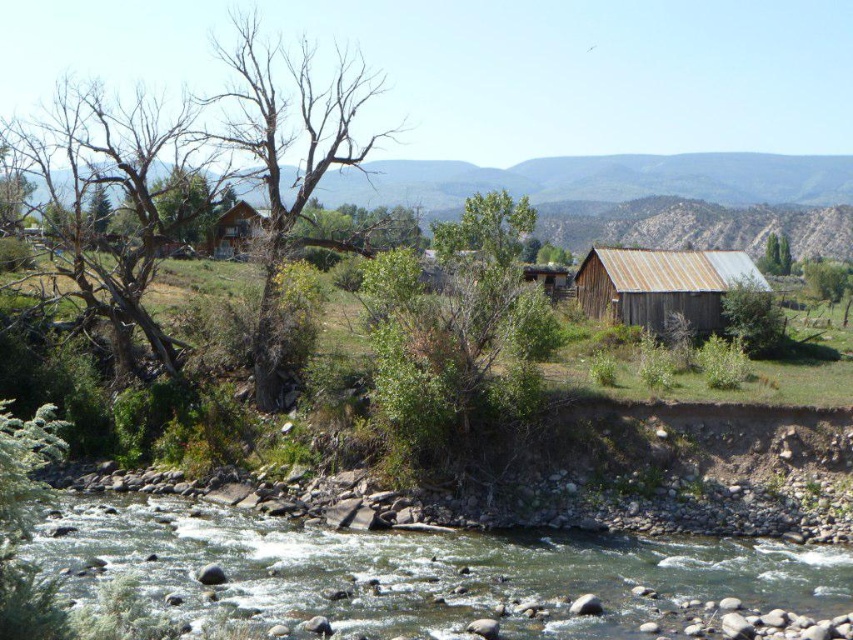
Based on the photo, between bare wood tree at left and brown wooden cabin at upper center, which one is positioned higher?

bare wood tree at left is higher up.

Image resolution: width=853 pixels, height=640 pixels. Identify the location of bare wood tree at left. (115, 196).

Where is `bare wood tree at center`? bare wood tree at center is located at coordinates (286, 152).

In the scene shown: Is bare wood tree at center above green leafy tree at upper right?

Correct, bare wood tree at center is located above green leafy tree at upper right.

Is point (267, 333) farther from camera compared to point (788, 248)?

That is False.

Locate an element on the screen. The width and height of the screenshot is (853, 640). bare wood tree at center is located at coordinates (286, 152).

Does bare wood tree at left appear on the left side of green leafy tree at right?

Yes, bare wood tree at left is to the left of green leafy tree at right.

Measure the distance between point (106,262) and camera.

Point (106,262) is 45.85 meters from camera.

Where is `bare wood tree at left`? Image resolution: width=853 pixels, height=640 pixels. bare wood tree at left is located at coordinates (115, 196).